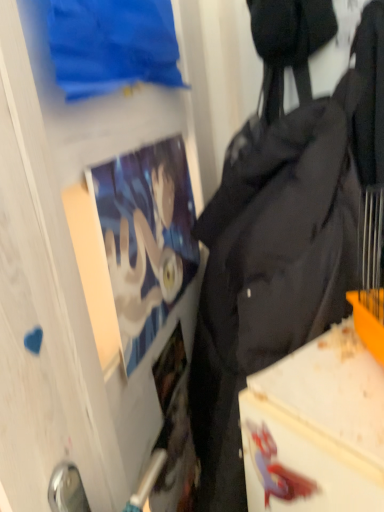
Question: Is matte paper poster at upper left far away from transparent glass door at upper center?

Choices:
 (A) no
 (B) yes

Answer: (A)

Question: Considering the relative sizes of matte paper poster at upper left and transparent glass door at upper center in the image provided, is matte paper poster at upper left wider than transparent glass door at upper center?

Choices:
 (A) yes
 (B) no

Answer: (B)

Question: Is transparent glass door at upper center located within matte paper poster at upper left?

Choices:
 (A) no
 (B) yes

Answer: (A)

Question: Is matte paper poster at upper left bigger than transparent glass door at upper center?

Choices:
 (A) yes
 (B) no

Answer: (B)

Question: Does matte paper poster at upper left have a smaller size compared to transparent glass door at upper center?

Choices:
 (A) no
 (B) yes

Answer: (B)

Question: In the image, is transparent glass door at upper center positioned in front of or behind matte paper poster at upper left?

Choices:
 (A) behind
 (B) front

Answer: (B)

Question: Does point (56, 243) appear closer or farther from the camera than point (109, 254)?

Choices:
 (A) closer
 (B) farther

Answer: (A)

Question: Looking at their shapes, would you say transparent glass door at upper center is wider or thinner than matte paper poster at upper left?

Choices:
 (A) thin
 (B) wide

Answer: (B)

Question: Would you say transparent glass door at upper center is inside or outside matte paper poster at upper left?

Choices:
 (A) outside
 (B) inside

Answer: (A)

Question: From the image's perspective, is transparent glass door at upper center located above or below black fabric backpack at right?

Choices:
 (A) above
 (B) below

Answer: (A)

Question: From a real-world perspective, is transparent glass door at upper center above or below black fabric backpack at right?

Choices:
 (A) above
 (B) below

Answer: (A)

Question: Choose the correct answer: Is transparent glass door at upper center inside black fabric backpack at right or outside it?

Choices:
 (A) outside
 (B) inside

Answer: (A)

Question: Looking at their shapes, would you say transparent glass door at upper center is wider or thinner than black fabric backpack at right?

Choices:
 (A) wide
 (B) thin

Answer: (B)

Question: Is point (183, 177) positioned closer to the camera than point (21, 343)?

Choices:
 (A) farther
 (B) closer

Answer: (A)

Question: Would you say matte paper poster at upper left is to the left or to the right of transparent glass door at upper center in the picture?

Choices:
 (A) right
 (B) left

Answer: (A)